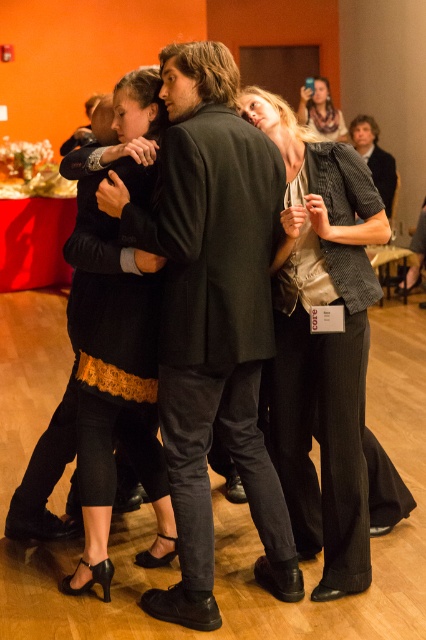
Question: Does black matte suit at center appear under textured gray blazer at center?

Choices:
 (A) yes
 (B) no

Answer: (B)

Question: Which point is closer to the camera?

Choices:
 (A) matte beige scarf at upper center
 (B) black matte suit at center

Answer: (B)

Question: Which point is closer to the camera taking this photo?

Choices:
 (A) (301, 97)
 (B) (276, 408)

Answer: (B)

Question: Does black matte suit at center have a larger size compared to matte beige scarf at upper center?

Choices:
 (A) no
 (B) yes

Answer: (B)

Question: Which point is closer to the camera taking this photo?

Choices:
 (A) (198, 372)
 (B) (336, 116)

Answer: (A)

Question: Is black matte suit at center below matte beige scarf at upper center?

Choices:
 (A) no
 (B) yes

Answer: (B)